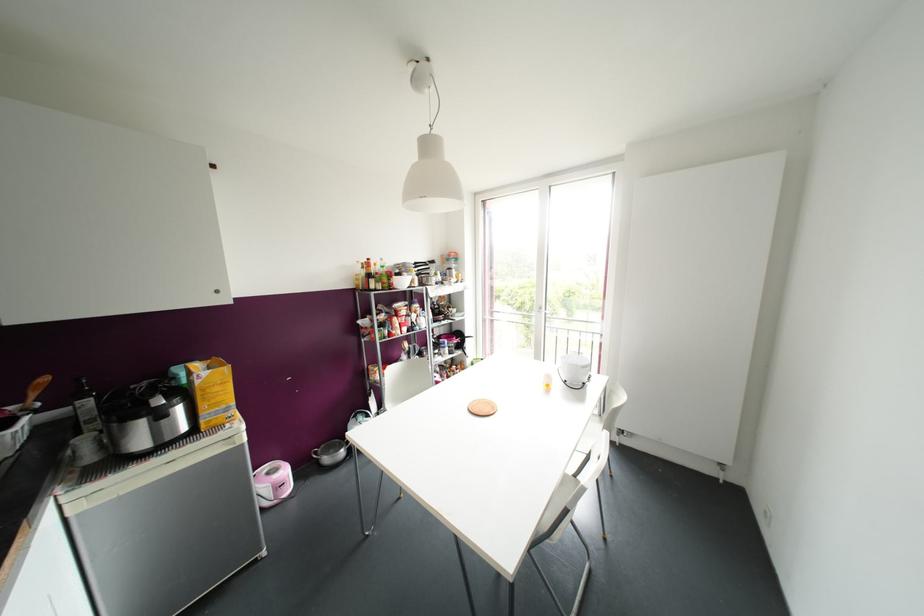
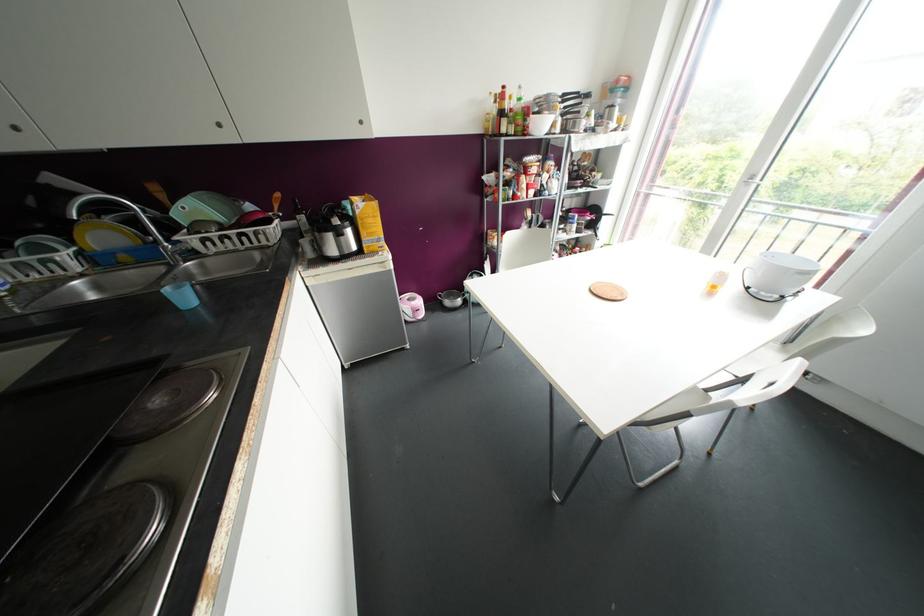
In the second image, find the point that corresponds to point (215, 387) in the first image.

(370, 220)